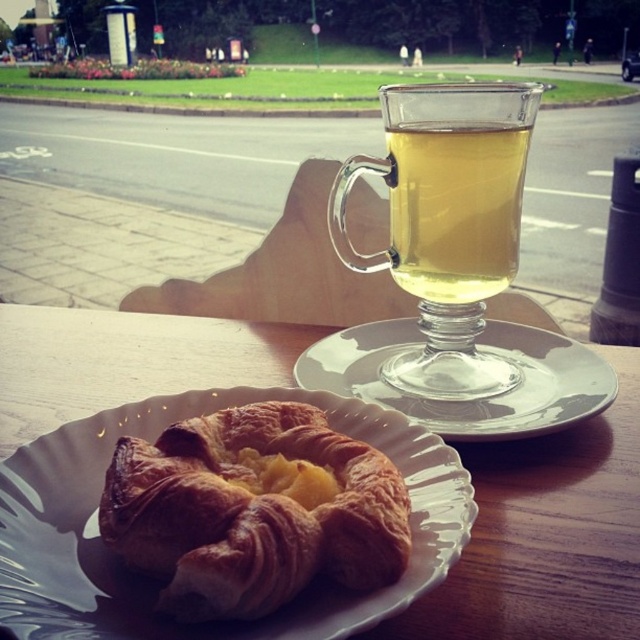
You are a customer at the outdoor breakfast spot and want to place your phone on the table between the croissant and the mug. The coordinates of the croissant are point (470, 621) and the mug is at point (406, 86). Which coordinate should you choose to ensure it is closer to the croissant?

You should choose point (470, 621) because it is closer to the croissant than the mug. Since the point is closer to the camera than the other point, it would be nearer to the croissant.

You are a barista holding a 9 inch wide tray. You need to place the transparent glass cup at upper center onto the tray. Can you fit it on the tray?

The transparent glass cup at upper center and viewer are 8.91 inches apart. Since the tray is 9 inches wide, the transparent glass cup at upper center can fit on the tray as it is slightly smaller than the tray.